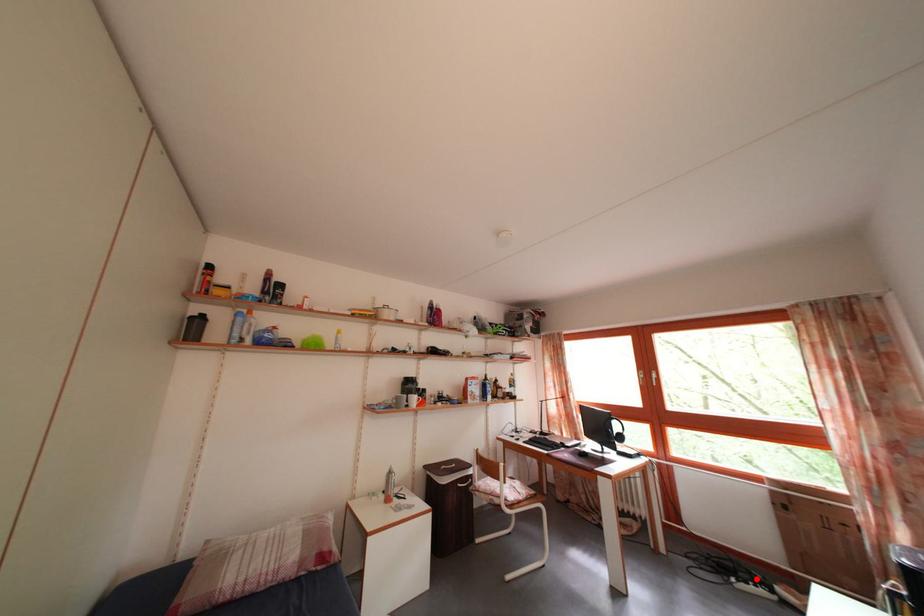
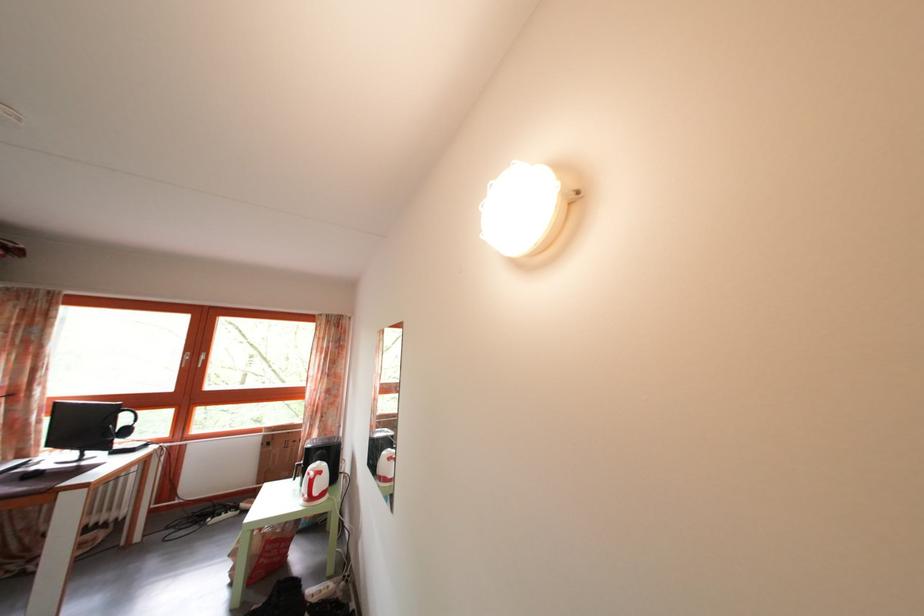
The point at the highlighted location is marked in the first image. Where is the corresponding point in the second image?

(233, 514)